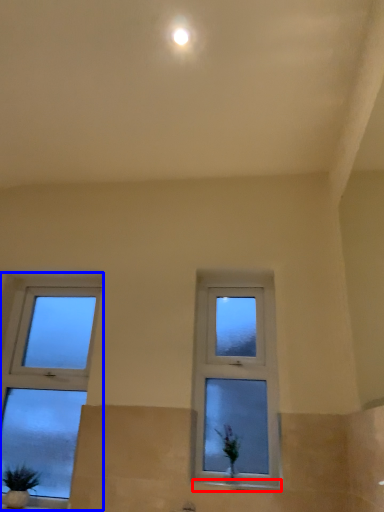
Question: Which of the following is the closest to the observer, window sill (highlighted by a red box) or window (highlighted by a blue box)?

Choices:
 (A) window sill
 (B) window

Answer: (A)